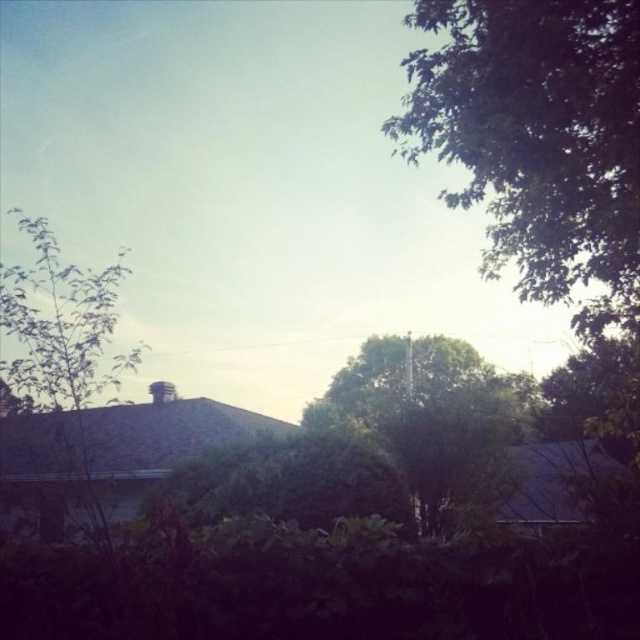
Question: Where is green leafy tree at upper right located in relation to green leafy tree at center in the image?

Choices:
 (A) above
 (B) below

Answer: (A)

Question: Which point is farther from the camera taking this photo?

Choices:
 (A) (65, 276)
 (B) (502, 243)

Answer: (B)

Question: Is green leafy tree at upper right in front of green leafy tree at center?

Choices:
 (A) yes
 (B) no

Answer: (A)

Question: Does green leafy tree at upper right have a lesser width compared to green leafy tree at left?

Choices:
 (A) yes
 (B) no

Answer: (B)

Question: Which object appears closest to the camera in this image?

Choices:
 (A) green leafy tree at center
 (B) green leafy tree at left

Answer: (B)

Question: Which object is positioned farthest from the green leafy tree at upper right?

Choices:
 (A) green leafy tree at center
 (B) green leafy tree at left

Answer: (A)